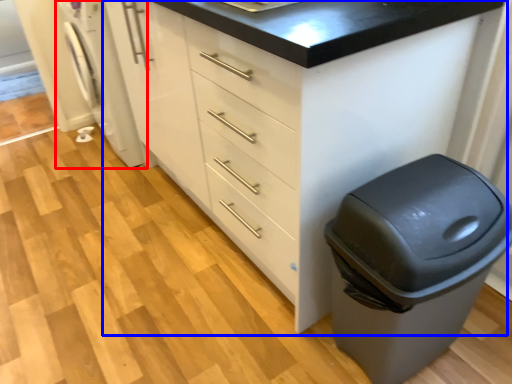
Question: Which of the following is the farthest to the observer, washing machine (highlighted by a red box) or chest of drawers (highlighted by a blue box)?

Choices:
 (A) washing machine
 (B) chest of drawers

Answer: (A)